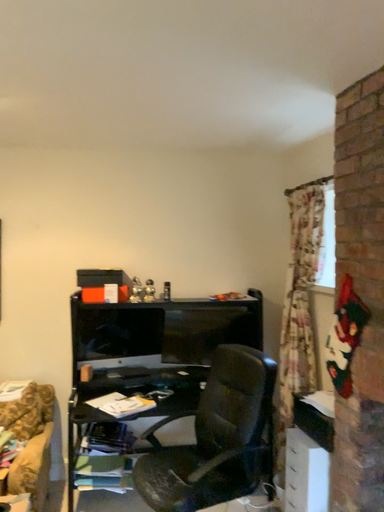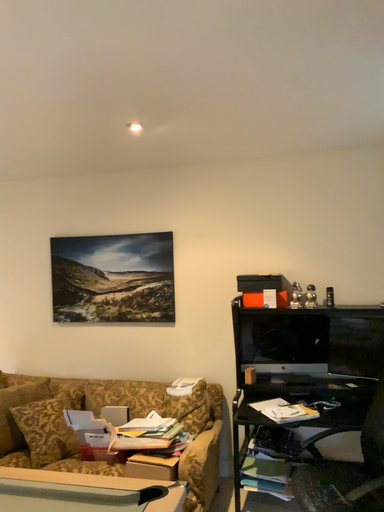
Question: Which way did the camera rotate in the video?

Choices:
 (A) rotated right
 (B) rotated left

Answer: (B)